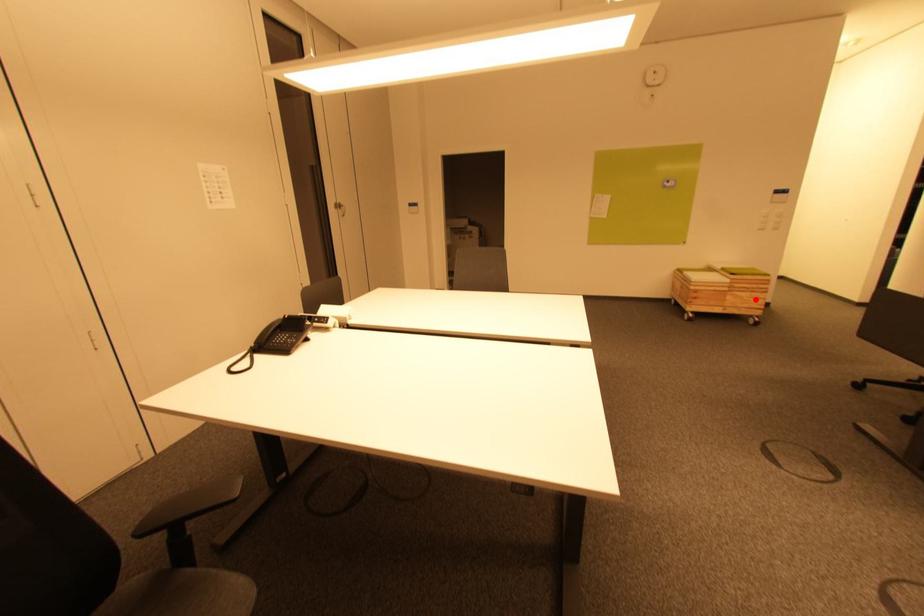
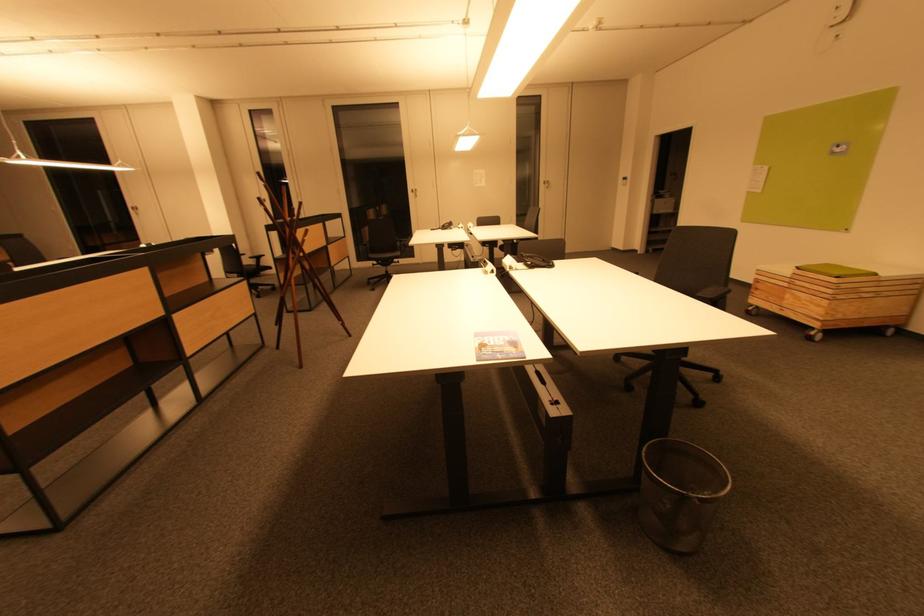
Locate, in the second image, the point that corresponds to the highlighted location in the first image.

(816, 305)